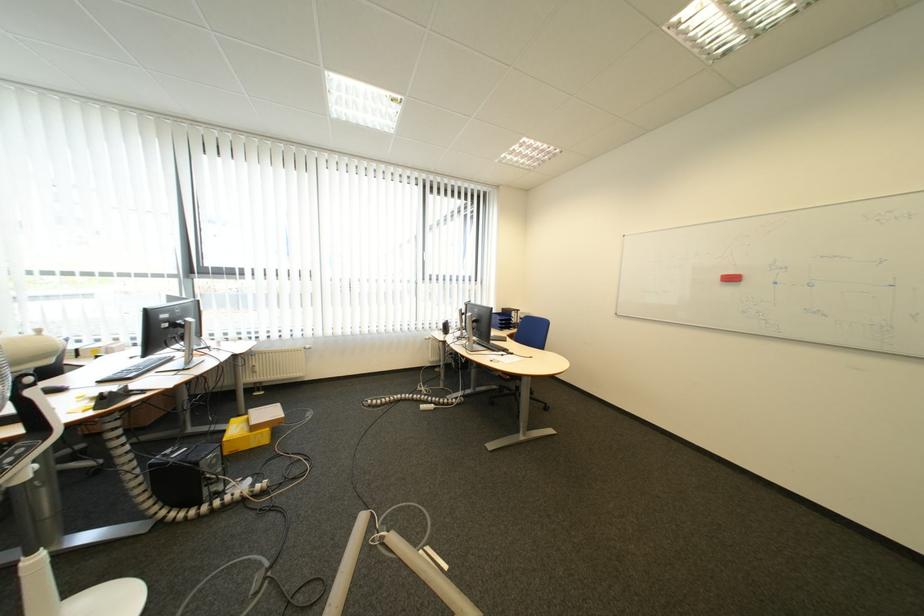
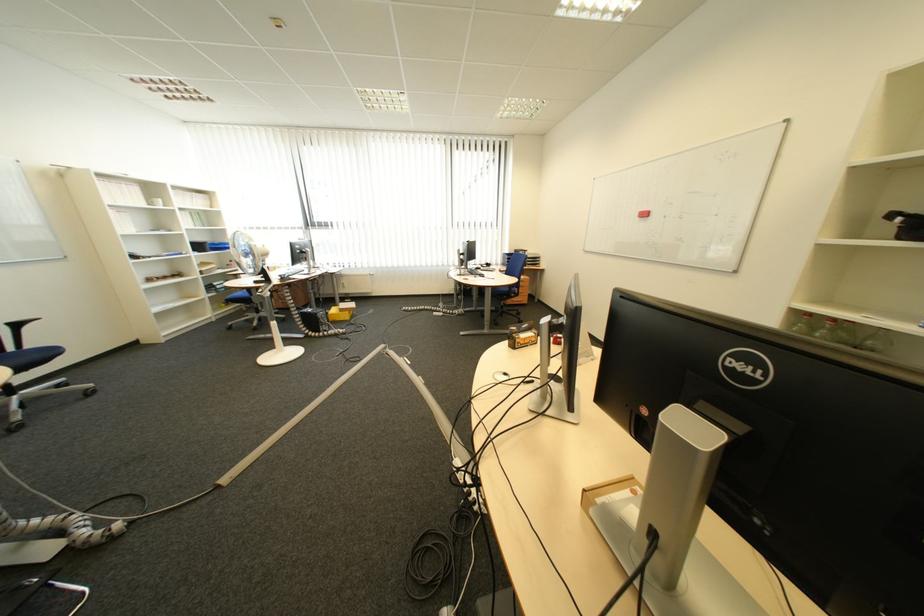
Locate, in the second image, the point that corresponds to (226,463) in the first image.

(335, 317)